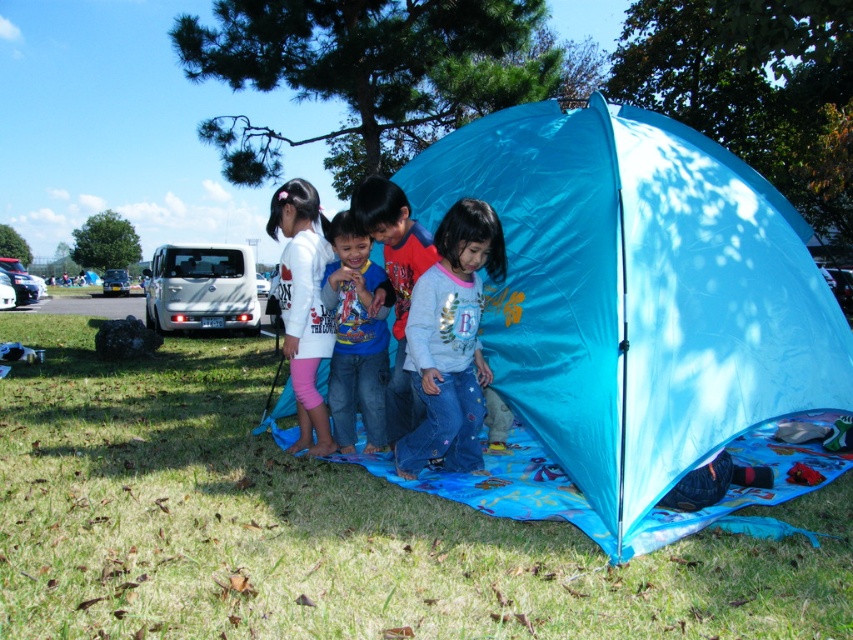
Question: Is blue tarpaulin tent at center in front of light blue denim pants at center?

Choices:
 (A) yes
 (B) no

Answer: (A)

Question: Which point is closer to the camera?

Choices:
 (A) white matte shirt at center
 (B) blue cotton shirt at center

Answer: (B)

Question: Based on their relative distances, which object is farther from the blue cotton shirt at center?

Choices:
 (A) white matte shirt at center
 (B) blue tarpaulin tent at center
 (C) light blue denim pants at center

Answer: (B)

Question: Can you confirm if light blue denim pants at center is positioned above white matte shirt at center?

Choices:
 (A) no
 (B) yes

Answer: (A)

Question: Is blue tarpaulin tent at center bigger than light blue denim pants at center?

Choices:
 (A) yes
 (B) no

Answer: (A)

Question: Which point is farther to the camera?

Choices:
 (A) (605, 328)
 (B) (442, 416)
 (C) (279, 216)

Answer: (C)